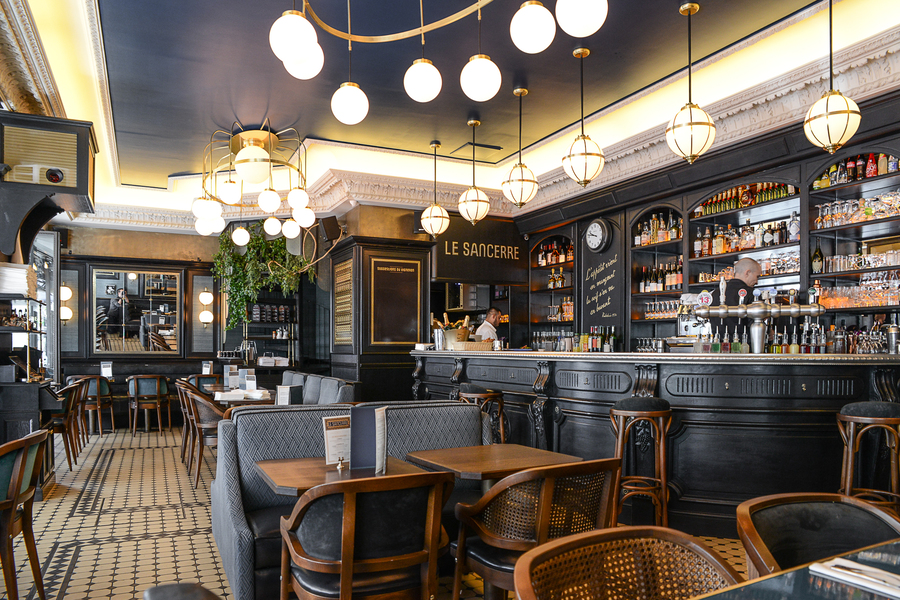
Find the location of a particular element. This screenshot has height=600, width=900. gray booths is located at coordinates (279, 418), (445, 418), (333, 391), (309, 382), (292, 376).